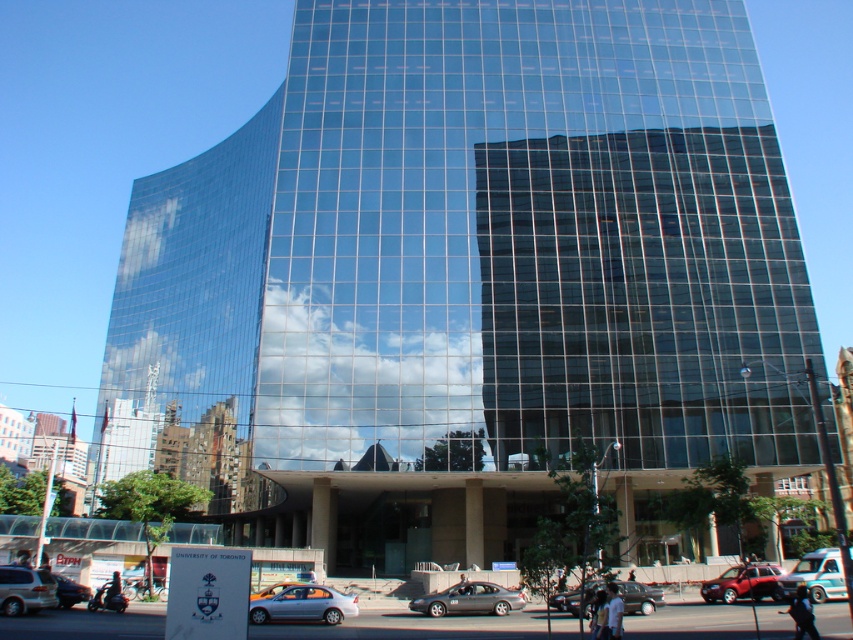
Question: Where is silver metallic van at lower left located in relation to shiny metallic car at lower left in the image?

Choices:
 (A) below
 (B) above

Answer: (B)

Question: Does shiny silver sedan at lower center appear on the right side of shiny metallic car at lower left?

Choices:
 (A) no
 (B) yes

Answer: (B)

Question: Which of the following is the farthest from the observer?

Choices:
 (A) (x=65, y=577)
 (B) (x=33, y=604)
 (C) (x=254, y=621)
 (D) (x=773, y=572)

Answer: (A)

Question: Which object is farther from the camera taking this photo?

Choices:
 (A) metallic silver sedan at center
 (B) shiny metallic car at lower left

Answer: (B)

Question: Which object is positioned closest to the silver metallic van at lower left?

Choices:
 (A) metallic silver sedan at center
 (B) shiny silver sedan at lower center

Answer: (A)

Question: Is silver metallic sedan at center behind silver metallic van at lower left?

Choices:
 (A) no
 (B) yes

Answer: (B)